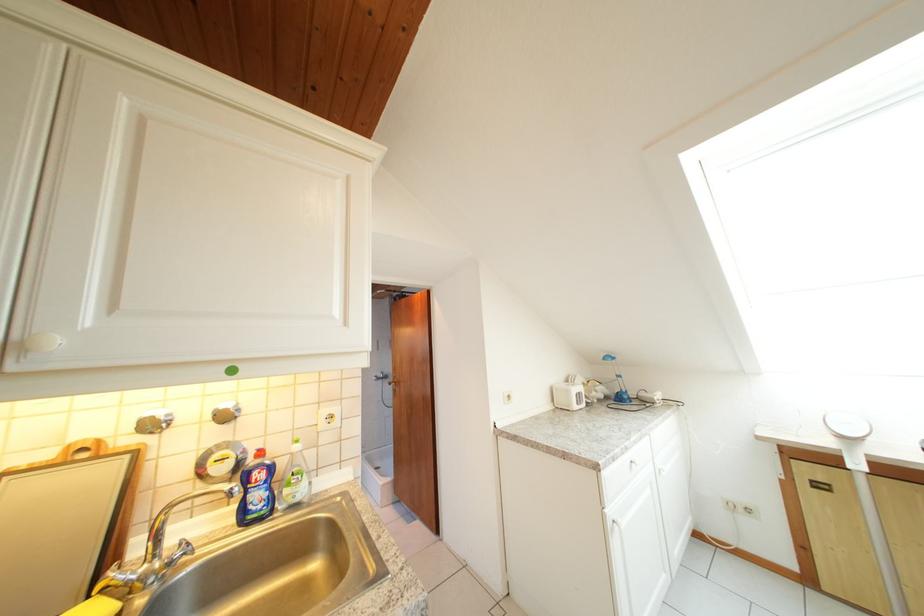
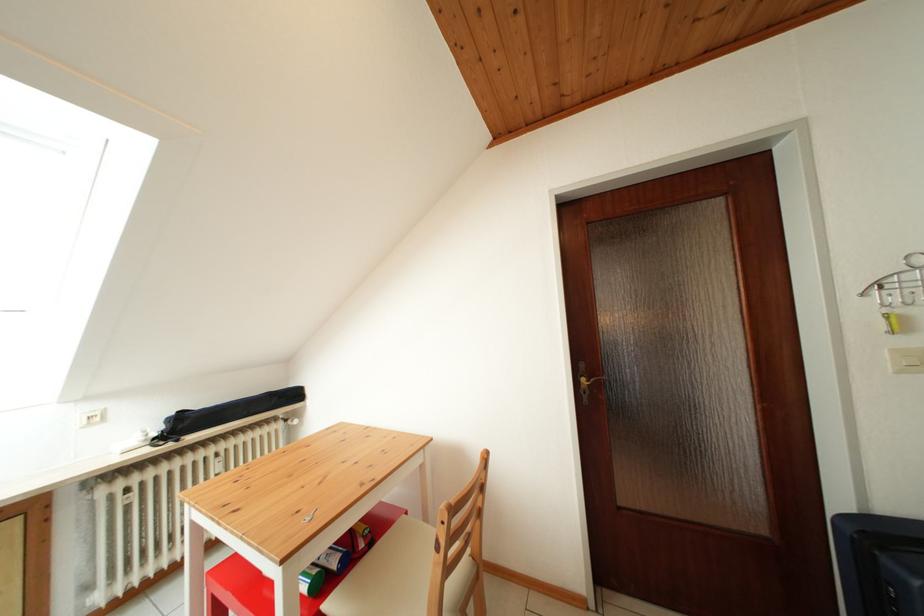
Question: The first image is from the beginning of the video and the second image is from the end. How did the camera likely rotate when shooting the video?

Choices:
 (A) Left
 (B) Right
 (C) Up
 (D) Down

Answer: (B)